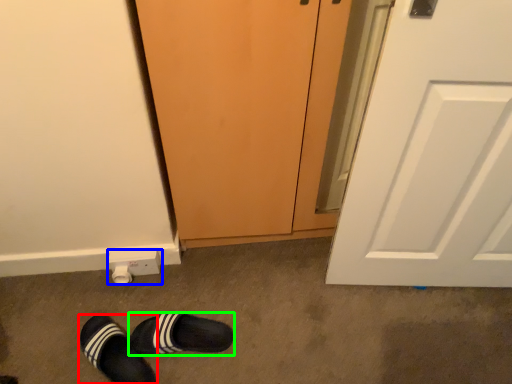
Question: Which object is positioned farthest from footwear (highlighted by a red box)? Select from electric outlet (highlighted by a blue box) and footwear (highlighted by a green box).

Choices:
 (A) electric outlet
 (B) footwear

Answer: (A)